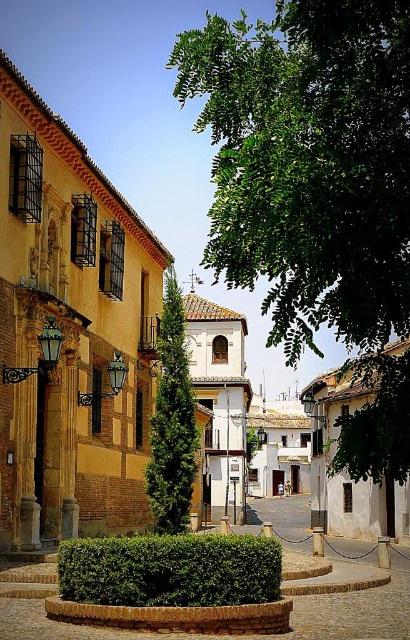
Question: Considering the real-world distances, which object is farthest from the green textured tree at center?

Choices:
 (A) green leafy tree at center
 (B) green leafy hedge at center

Answer: (A)

Question: Is green leafy hedge at center to the left of green textured tree at center from the viewer's perspective?

Choices:
 (A) yes
 (B) no

Answer: (B)

Question: Is green leafy tree at center to the left of green leafy hedge at center from the viewer's perspective?

Choices:
 (A) yes
 (B) no

Answer: (B)

Question: Which object appears farthest from the camera in this image?

Choices:
 (A) green leafy hedge at center
 (B) green leafy tree at center
 (C) green textured tree at center

Answer: (C)

Question: Which object appears closest to the camera in this image?

Choices:
 (A) green textured tree at center
 (B) green leafy hedge at center

Answer: (B)

Question: Is green leafy hedge at center bigger than green textured tree at center?

Choices:
 (A) no
 (B) yes

Answer: (A)